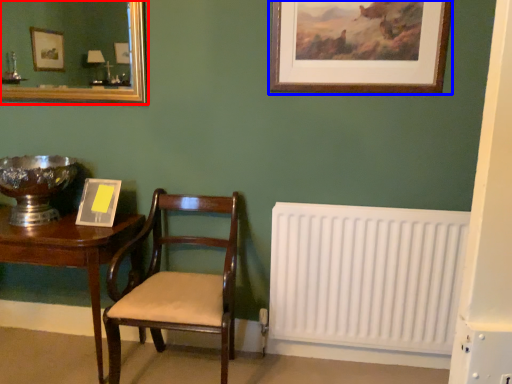
Question: Which point is further to the camera, mirror (highlighted by a red box) or picture frame (highlighted by a blue box)?

Choices:
 (A) mirror
 (B) picture frame

Answer: (A)